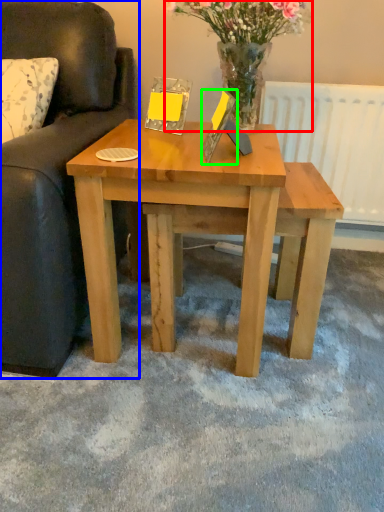
Question: Estimate the real-world distances between objects in this image. Which object is farther from floral arrangement (highlighted by a red box), studio couch (highlighted by a blue box) or picture frame (highlighted by a green box)?

Choices:
 (A) studio couch
 (B) picture frame

Answer: (A)